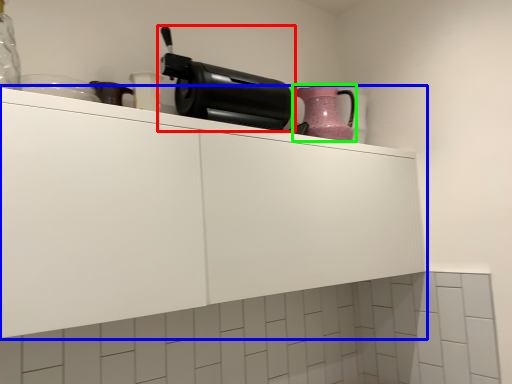
Question: Based on their relative distances, which object is farther from home appliance (highlighted by a red box)? Choose from cabinetry (highlighted by a blue box) and kitchen appliance (highlighted by a green box).

Choices:
 (A) cabinetry
 (B) kitchen appliance

Answer: (A)